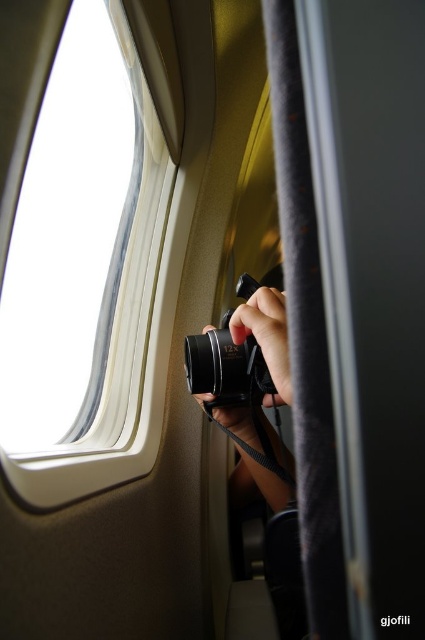
You are a photographer trying to capture a landscape through the airplane window. You have a matte black camera at center and a white plastic airplane window at upper left. Which object will allow you to see the landscape more clearly?

The white plastic airplane window at upper left is larger in size than the matte black camera at center, so the landscape can be seen more clearly through the window.

You are a photographer trying to capture a landscape through the airplane window. You have a matte black camera at center and a white plastic airplane window at upper left. Which object should you position closer to your face to take the photo?

You should position the matte black camera at center closer to your face because the white plastic airplane window at upper left is located above it, meaning the camera needs to be angled upwards to capture through the window.